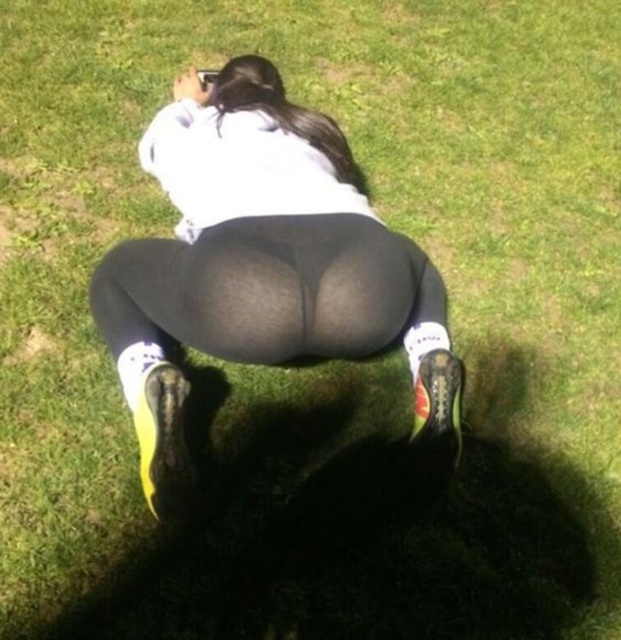
Question: Does matte black leggings at center have a greater width compared to black matte leggings at center?

Choices:
 (A) no
 (B) yes

Answer: (B)

Question: Which object appears closest to the camera in this image?

Choices:
 (A) matte black leggings at center
 (B) black matte leggings at center

Answer: (A)

Question: Can you confirm if matte black leggings at center is wider than black matte leggings at center?

Choices:
 (A) yes
 (B) no

Answer: (A)

Question: Which object is closer to the camera taking this photo?

Choices:
 (A) matte black leggings at center
 (B) black matte leggings at center

Answer: (A)

Question: Among these points, which one is nearest to the camera?

Choices:
 (A) (345, 339)
 (B) (445, 314)

Answer: (A)

Question: Can you confirm if matte black leggings at center is positioned above black matte leggings at center?

Choices:
 (A) yes
 (B) no

Answer: (A)